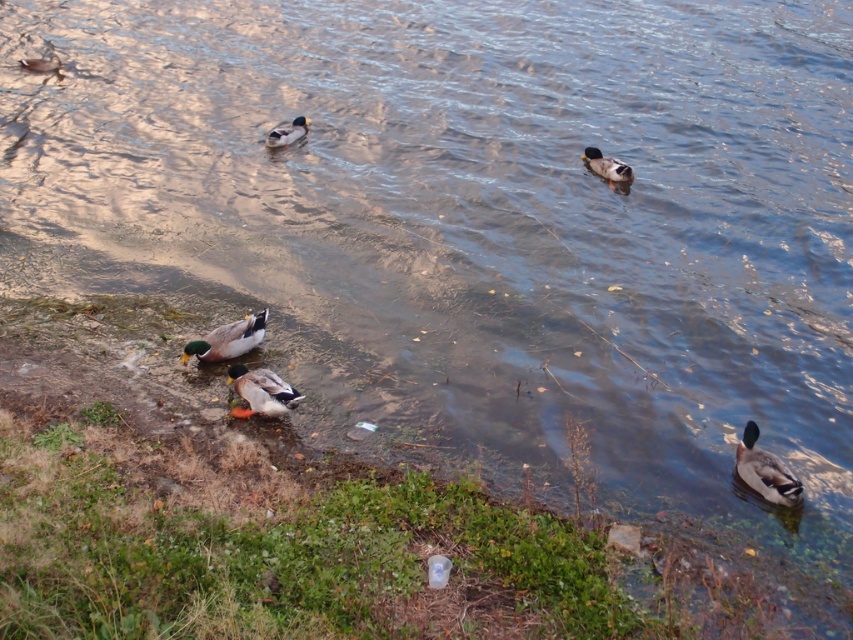
You are standing at the shoreline and want to pick up the small plastic cup near the water. There is a green glossy duck at upper right swimming away from you. If the duck continues moving away at a constant speed, will you be able to reach the cup before the duck gets further than 35 feet away from you?

The green glossy duck at upper right is currently 33.24 feet away. Since it is moving away at a constant speed, if it travels another 1.76 feet, it will exceed 35 feet. Depending on how quickly you can move towards the cup compared to the duck, you might be able to reach the cup before the duck reaches 35 feet. However, without knowing the exact speeds, it is uncertain. But since the current distance is under 35 feet, you have a chance if you act quickly.

You are a birdwatcher observing the ducks in the water. You notice the matte gray duck at center and the green glossy duck at lower left. Which duck is located closer to the water surface?

The matte gray duck at center is positioned under the green glossy duck at lower left, so the green glossy duck at lower left is closer to the water surface.

From the picture: In the scene with ducks on the water, there is a matte gray duck at center and a green glossy duck at lower left. Which duck takes up less space horizontally?

The matte gray duck at center has a lesser width compared to the green glossy duck at lower left, so it takes up less horizontal space.